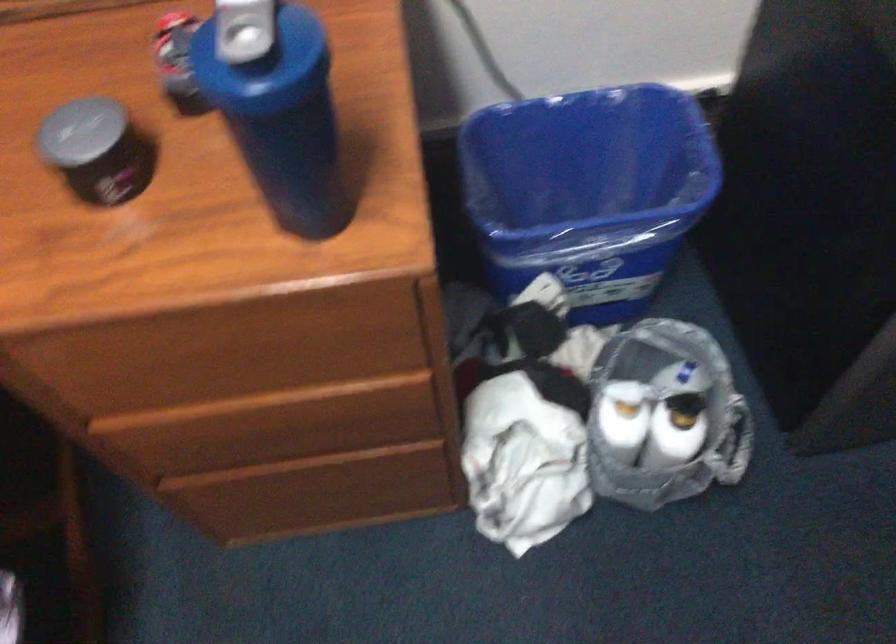
The height and width of the screenshot is (644, 896). I want to click on black jar lid, so click(80, 131).